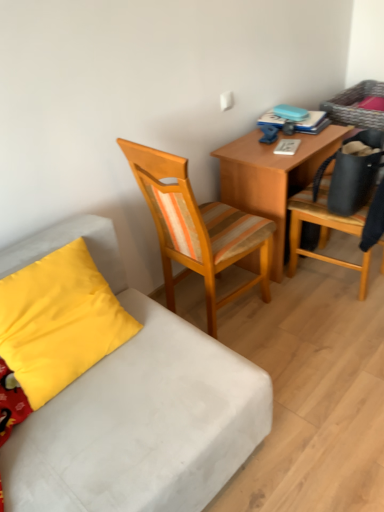
Question: Is wooden desk at center bigger or smaller than white fabric studio couch at lower left?

Choices:
 (A) big
 (B) small

Answer: (A)

Question: Is wooden desk at center inside or outside of white fabric studio couch at lower left?

Choices:
 (A) outside
 (B) inside

Answer: (A)

Question: Which object is positioned farthest from the white fabric studio couch at lower left?

Choices:
 (A) wooden chair at right, the first chair positioned from the right
 (B) wooden desk at center
 (C) woodenchair at center, the first chair positioned from the left
 (D) yellow fabric pillow at lower left

Answer: (A)

Question: Which object is the closest to the white fabric studio couch at lower left?

Choices:
 (A) yellow fabric pillow at lower left
 (B) woodenchair at center, the first chair positioned from the left
 (C) wooden desk at center
 (D) wooden chair at right, the first chair positioned from the right

Answer: (A)